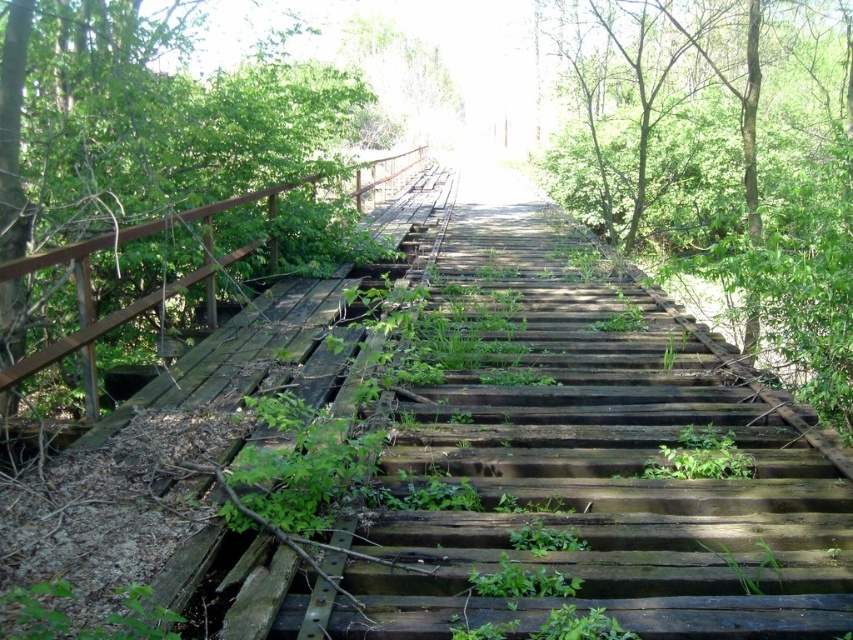
You are a hiker who needs to cross the weathered wooden bridge. You see the weathered wood stairs at center and the green leafy tree at left. Which object is bigger in size?

The weathered wood stairs at center is larger in size than the green leafy tree at left.

You are standing on the old wooden bridge and notice a point at coordinates (721,164). What object is located at that point?

The green leafy tree at center is located at point (721,164).